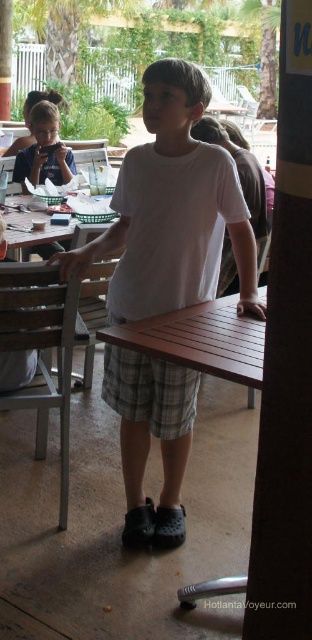
Question: Does white cotton shirt at center have a greater width compared to brown wooden picnic table at center?

Choices:
 (A) yes
 (B) no

Answer: (A)

Question: Considering the real-world distances, which object is farthest from the brown wooden table at center?

Choices:
 (A) white cotton shirt at center
 (B) brown wooden picnic table at center

Answer: (A)

Question: Which is nearer to the white cotton shirt at center?

Choices:
 (A) brown wooden table at center
 (B) brown wooden picnic table at center

Answer: (A)

Question: Which is nearer to the brown wooden table at center?

Choices:
 (A) white cotton shirt at center
 (B) brown wooden picnic table at center

Answer: (B)

Question: From the image, what is the correct spatial relationship of white cotton shirt at center in relation to brown wooden table at center?

Choices:
 (A) left
 (B) right

Answer: (A)

Question: Does white cotton shirt at center have a lesser width compared to brown wooden picnic table at center?

Choices:
 (A) yes
 (B) no

Answer: (B)